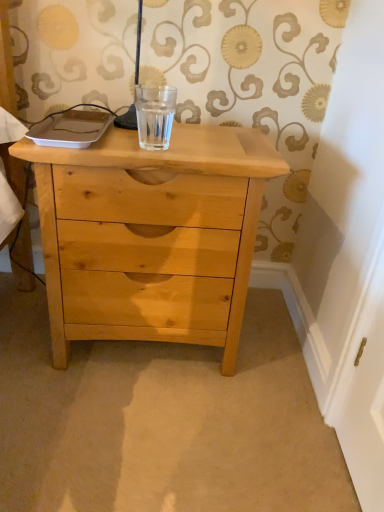
Question: Would you say natural wood chest of drawers at center is outside clear glass water at center?

Choices:
 (A) no
 (B) yes

Answer: (B)

Question: From the image's perspective, is natural wood chest of drawers at center located beneath clear glass water at center?

Choices:
 (A) no
 (B) yes

Answer: (B)

Question: Is natural wood chest of drawers at center facing towards clear glass water at center?

Choices:
 (A) yes
 (B) no

Answer: (B)

Question: Is natural wood chest of drawers at center directly adjacent to clear glass water at center?

Choices:
 (A) no
 (B) yes

Answer: (A)

Question: Is natural wood chest of drawers at center taller than clear glass water at center?

Choices:
 (A) yes
 (B) no

Answer: (A)

Question: Is natural wood chest of drawers at center at the right side of clear glass water at center?

Choices:
 (A) yes
 (B) no

Answer: (B)

Question: Considering the relative sizes of clear glass water at center and natural wood chest of drawers at center in the image provided, is clear glass water at center wider than natural wood chest of drawers at center?

Choices:
 (A) yes
 (B) no

Answer: (B)

Question: Is clear glass water at center smaller than natural wood chest of drawers at center?

Choices:
 (A) yes
 (B) no

Answer: (A)

Question: Is clear glass water at center to the left of natural wood chest of drawers at center from the viewer's perspective?

Choices:
 (A) yes
 (B) no

Answer: (B)

Question: From a real-world perspective, is clear glass water at center located beneath natural wood chest of drawers at center?

Choices:
 (A) yes
 (B) no

Answer: (B)

Question: Does clear glass water at center have a lesser width compared to natural wood chest of drawers at center?

Choices:
 (A) no
 (B) yes

Answer: (B)

Question: Is clear glass water at center closer to camera compared to natural wood chest of drawers at center?

Choices:
 (A) yes
 (B) no

Answer: (B)

Question: Looking at the image, does clear glass water at center seem bigger or smaller compared to natural wood chest of drawers at center?

Choices:
 (A) small
 (B) big

Answer: (A)